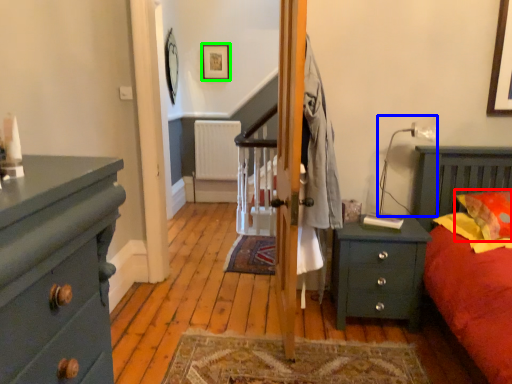
Question: Based on their relative distances, which object is nearer to pillow (highlighted by a red box)? Choose from lamp (highlighted by a blue box) and picture frame (highlighted by a green box).

Choices:
 (A) lamp
 (B) picture frame

Answer: (A)